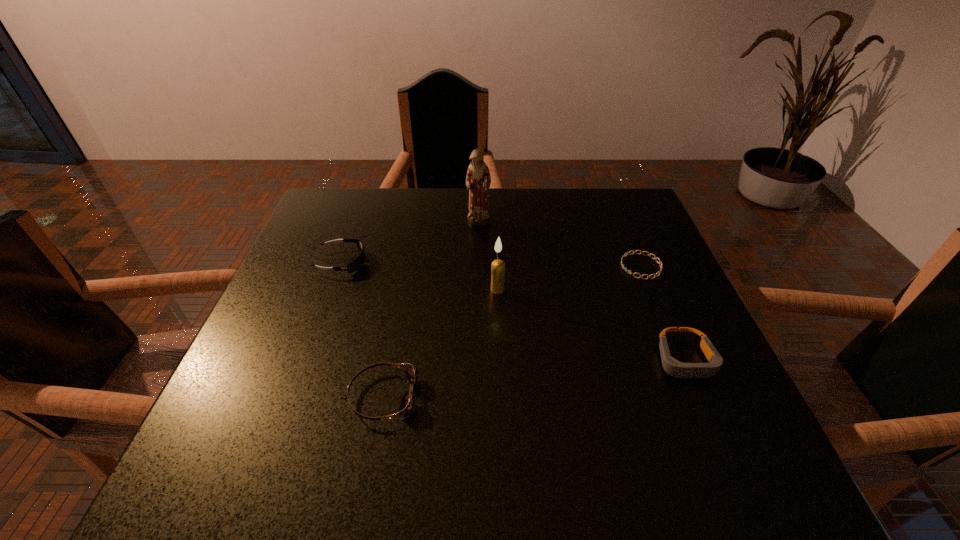
Find the location of a particular element. figurine is located at coordinates (478, 180).

Locate an element on the screen. The image size is (960, 540). the farthest object is located at coordinates (x=478, y=180).

Where is `the fourth farthest object`? The width and height of the screenshot is (960, 540). the fourth farthest object is located at coordinates (498, 266).

At what (x,y) coordinates should I click in order to perform the action: click on the second tallest object. Please return your answer as a coordinate pair (x, y). Looking at the image, I should click on (498, 266).

Locate an element on the screen. This screenshot has width=960, height=540. the farthest goggles is located at coordinates (357, 263).

Locate an element on the screen. the leftmost object is located at coordinates (357, 263).

At what (x,y) coordinates should I click in order to perform the action: click on the fifth object from right to left. Please return your answer as a coordinate pair (x, y). The width and height of the screenshot is (960, 540). Looking at the image, I should click on (407, 405).

Locate an element on the screen. the rightmost goggles is located at coordinates (673, 367).

You are a GUI agent. You are given a task and a screenshot of the screen. Output one action in this format:
    pyautogui.click(x=<x>, y=<y>)
    Task: Click on the bracelet
    
    Given the screenshot: What is the action you would take?
    pyautogui.click(x=661, y=265)

This screenshot has width=960, height=540. What are the coordinates of `blank space located 0.290m on the front-facing side of the tallest object` in the screenshot? It's located at (478, 310).